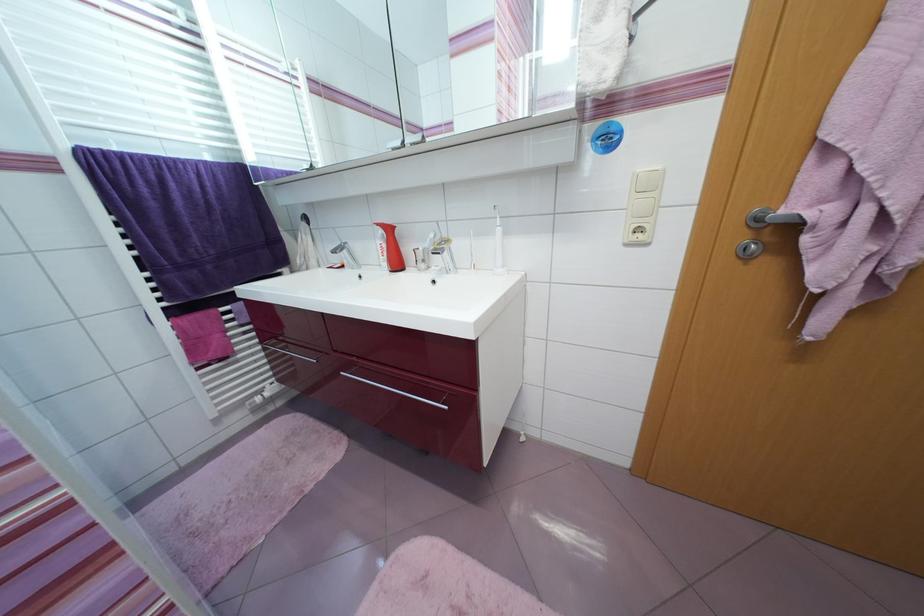
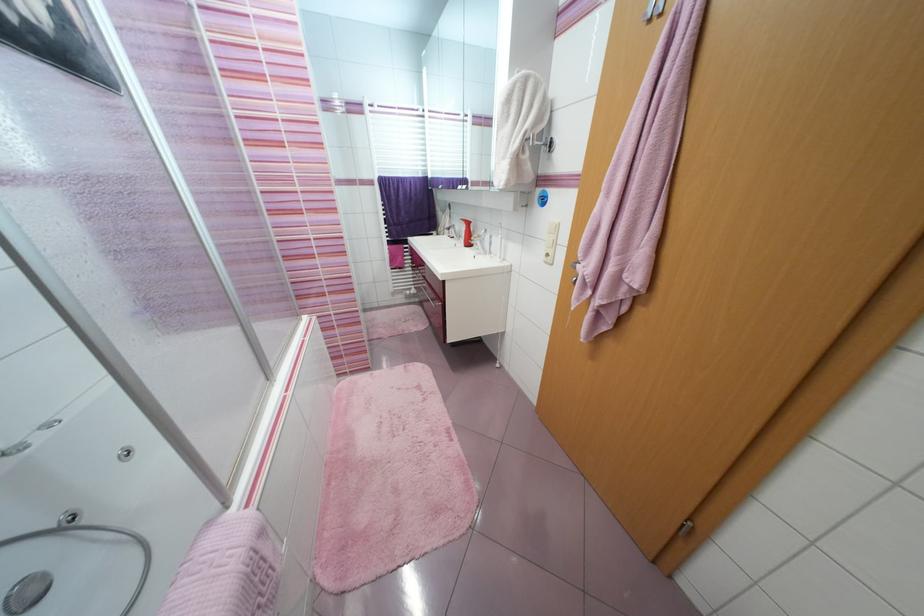
The point at (631, 246) is marked in the first image. Where is the corresponding point in the second image?

(551, 264)